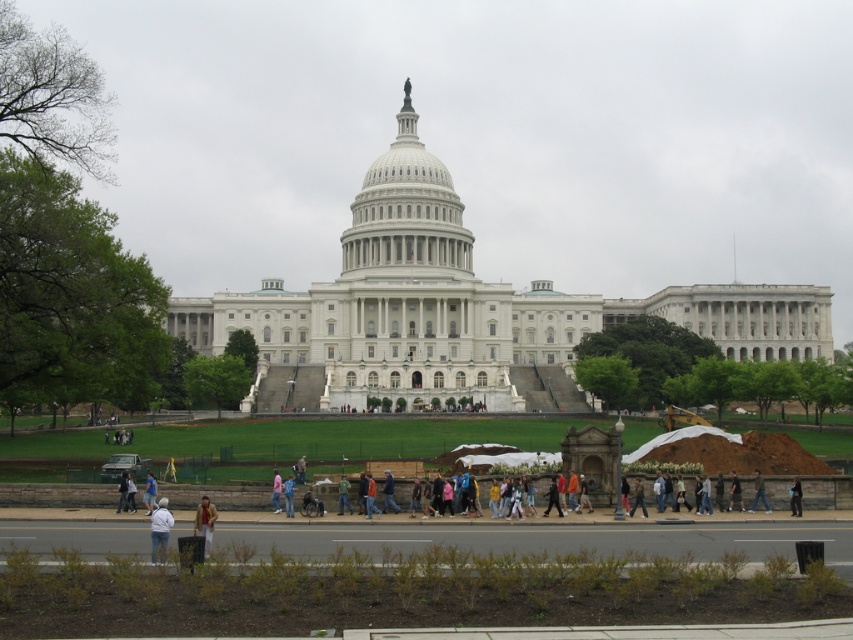
You are a photographer planning to take a picture of the United States Capitol Building. You notice a light brown leather jacket at lower left and a white matte person at center in your frame. If you want to ensure both objects are clearly visible in the photo, which one should you adjust your focus on to prioritize based on their sizes?

The light brown leather jacket at lower left is smaller than the white matte person at center, so you should prioritize focusing on the white matte person at center to ensure clarity since it is larger and more prominent in the scene.

Consider the image. You are standing in front of the grand neoclassical building with the large central dome. You see a light brown leather jacket at lower left. Where exactly is the light brown leather jacket located in terms of coordinates?

The light brown leather jacket at lower left is located at coordinates (123,492).

You are a photographer positioned at the lower center of the scene, holding a camera. You want to capture a photo of both the light brown leather jacket at lower center and the denim jacket at lower right in the same frame. Given that your camera has a 50mm lens, which has a field of view of approximately 46 degrees, can you include both jackets in your current position without moving?

The light brown leather jackets at lower center and denim jacket at lower right are 27.60 meters apart. With a 50mm lens providing a 46 degree field of view, the maximum distance between two objects that can be captured in the same frame would be approximately 27.60 meters. Since the distance matches the field of view, it is possible to include both jackets in the frame without moving.